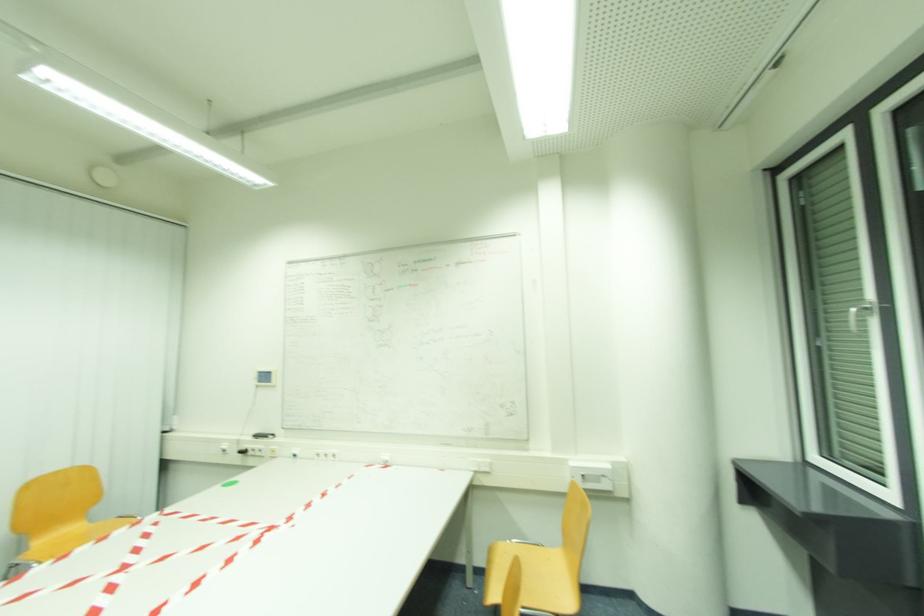
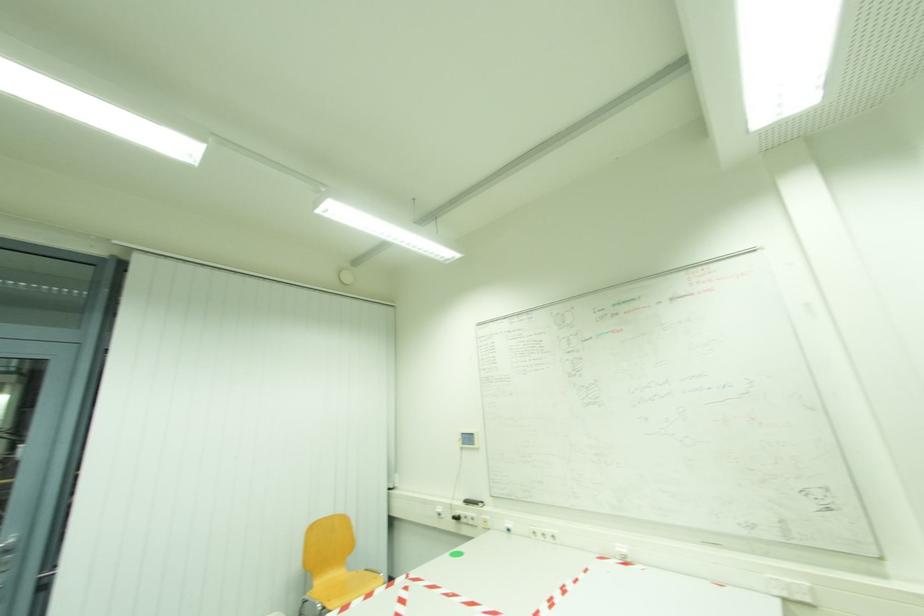
Question: The first image is from the beginning of the video and the second image is from the end. How did the camera likely rotate when shooting the video?

Choices:
 (A) Left
 (B) Right
 (C) Up
 (D) Down

Answer: (A)